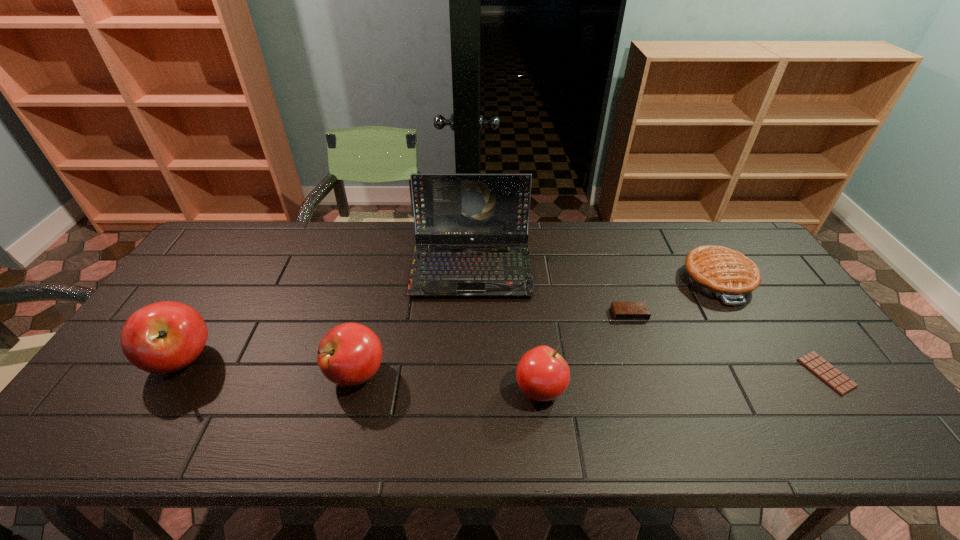
Locate an element on the screen. This screenshot has width=960, height=540. object that is at the left edge is located at coordinates (163, 337).

The height and width of the screenshot is (540, 960). I want to click on pie that is at the right edge, so click(719, 272).

Where is `candy bar situated at the right edge`? The image size is (960, 540). candy bar situated at the right edge is located at coordinates (839, 382).

Where is `object that is at the near left corner`? The image size is (960, 540). object that is at the near left corner is located at coordinates (163, 337).

Identify the location of object located at the far right corner. The width and height of the screenshot is (960, 540). (719, 272).

This screenshot has width=960, height=540. I want to click on object at the near right corner, so click(x=839, y=382).

At what (x,y) coordinates should I click in order to perform the action: click on free spot at the far edge of the desktop. Please return your answer as a coordinate pair (x, y). The width and height of the screenshot is (960, 540). Looking at the image, I should click on (599, 232).

You are a GUI agent. You are given a task and a screenshot of the screen. Output one action in this format:
    pyautogui.click(x=<x>, y=<y>)
    Task: Click on the vacant region at the near edge of the desktop
    The width and height of the screenshot is (960, 540).
    Given the screenshot: What is the action you would take?
    pyautogui.click(x=616, y=394)

What are the coordinates of `vacant area at the left edge of the desktop` in the screenshot? It's located at (180, 281).

Image resolution: width=960 pixels, height=540 pixels. Find the location of `vacant space at the right edge of the desktop`. vacant space at the right edge of the desktop is located at coordinates (786, 371).